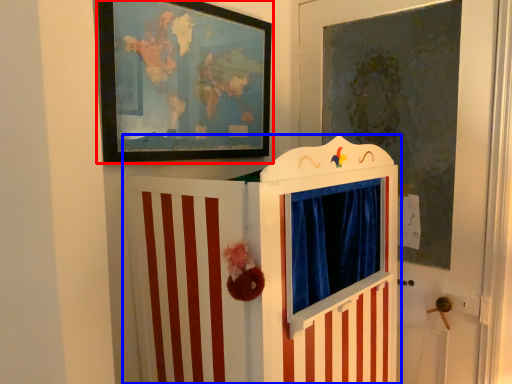
Question: Which object is further to the camera taking this photo, picture frame (highlighted by a red box) or furniture (highlighted by a blue box)?

Choices:
 (A) picture frame
 (B) furniture

Answer: (A)